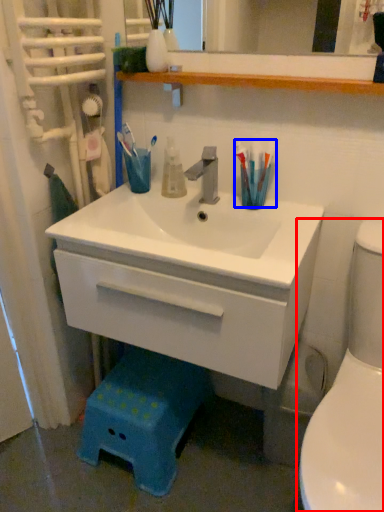
Question: Which object is further to the camera taking this photo, toilet (highlighted by a red box) or toothbrush (highlighted by a blue box)?

Choices:
 (A) toilet
 (B) toothbrush

Answer: (B)